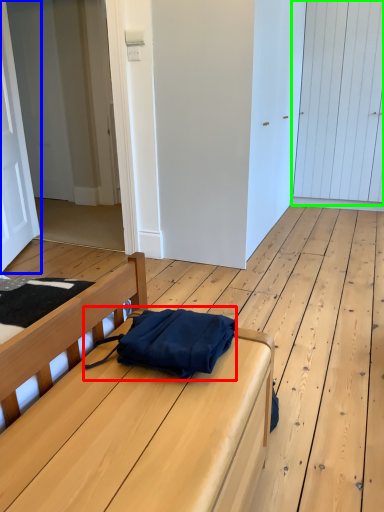
Question: Which object is the farthest from messenger bag (highlighted by a red box)? Choose among these: door (highlighted by a blue box) or door (highlighted by a green box).

Choices:
 (A) door
 (B) door

Answer: (B)